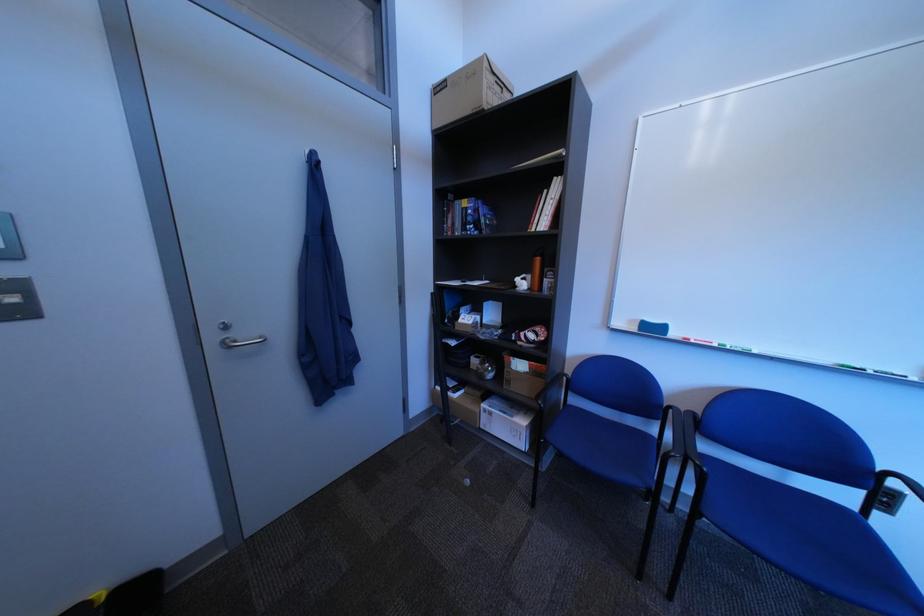
Locate an element on the screen. The height and width of the screenshot is (616, 924). white box is located at coordinates pyautogui.click(x=506, y=421).